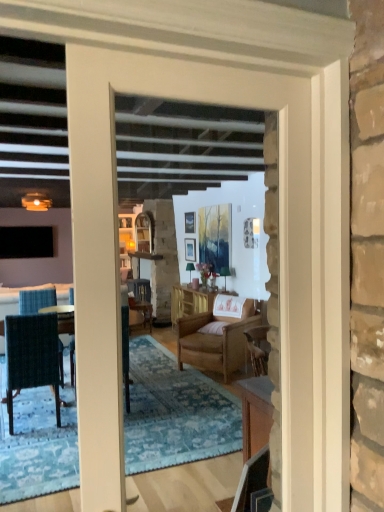
Question: Is matte gold lamp at upper left closer to camera compared to wooden cabinet at center?

Choices:
 (A) no
 (B) yes

Answer: (A)

Question: Is matte gold lamp at upper left at the left side of wooden cabinet at center?

Choices:
 (A) no
 (B) yes

Answer: (B)

Question: From the image's perspective, does matte gold lamp at upper left appear lower than wooden cabinet at center?

Choices:
 (A) no
 (B) yes

Answer: (A)

Question: Considering the relative sizes of matte gold lamp at upper left and wooden cabinet at center in the image provided, is matte gold lamp at upper left taller than wooden cabinet at center?

Choices:
 (A) yes
 (B) no

Answer: (B)

Question: From a real-world perspective, is matte gold lamp at upper left on wooden cabinet at center?

Choices:
 (A) yes
 (B) no

Answer: (A)

Question: Is matte gold lamp at upper left shorter than wooden cabinet at center?

Choices:
 (A) yes
 (B) no

Answer: (A)

Question: Does wooden chair at center, positioned as the 1th chair in back-to-front order, have a lesser height compared to wooden cabinet at center?

Choices:
 (A) yes
 (B) no

Answer: (A)

Question: Is wooden chair at center, acting as the second chair starting from the left, completely or partially outside of wooden cabinet at center?

Choices:
 (A) yes
 (B) no

Answer: (A)

Question: Considering the relative sizes of wooden chair at center, acting as the second chair starting from the left, and wooden cabinet at center in the image provided, is wooden chair at center, acting as the second chair starting from the left, wider than wooden cabinet at center?

Choices:
 (A) yes
 (B) no

Answer: (B)

Question: Is wooden chair at center, positioned as the 1th chair in back-to-front order, bigger than wooden cabinet at center?

Choices:
 (A) no
 (B) yes

Answer: (A)

Question: Does wooden chair at center, which appears as the 3th chair when viewed from the front, lie in front of wooden cabinet at center?

Choices:
 (A) no
 (B) yes

Answer: (A)

Question: Considering the relative sizes of wooden chair at center, positioned as the 1th chair in back-to-front order, and wooden cabinet at center in the image provided, is wooden chair at center, positioned as the 1th chair in back-to-front order, smaller than wooden cabinet at center?

Choices:
 (A) no
 (B) yes

Answer: (B)

Question: Does white wood door at center have a greater height compared to wooden cabinet at center?

Choices:
 (A) no
 (B) yes

Answer: (B)